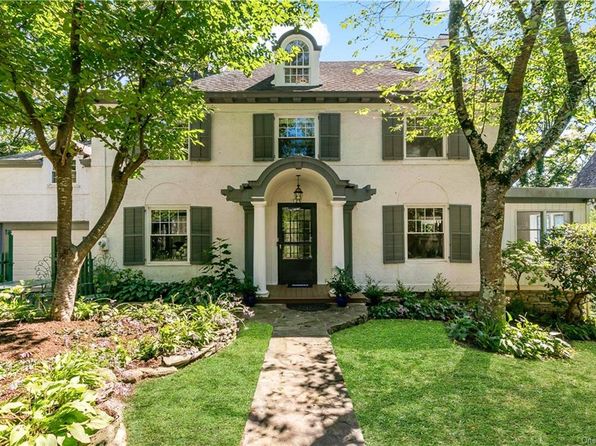
This screenshot has width=596, height=446. I want to click on support pillars, so click(x=260, y=251), click(x=339, y=242).